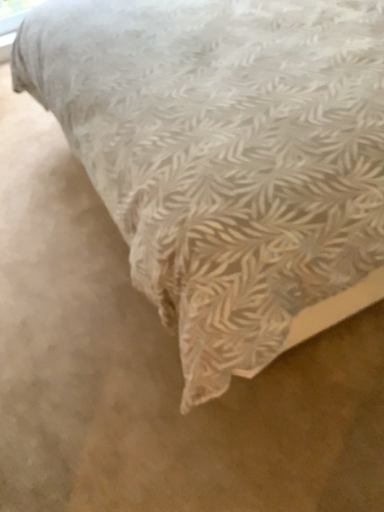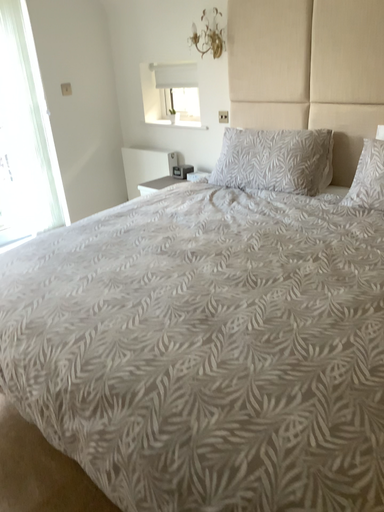
Question: Which way did the camera rotate in the video?

Choices:
 (A) rotated upward
 (B) rotated downward

Answer: (A)